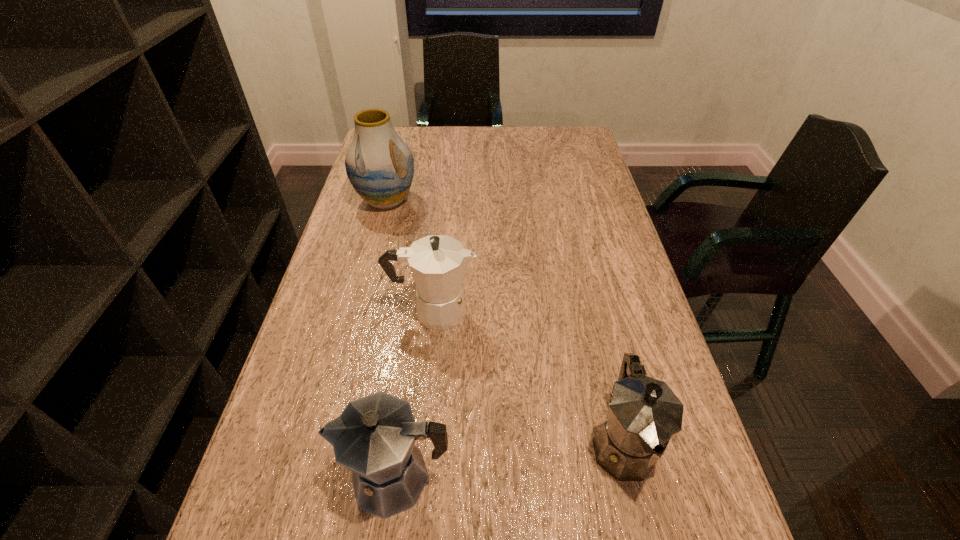
Where is `coffeepot that stands as the second closest to the third nearest object`? Image resolution: width=960 pixels, height=540 pixels. coffeepot that stands as the second closest to the third nearest object is located at coordinates (644, 414).